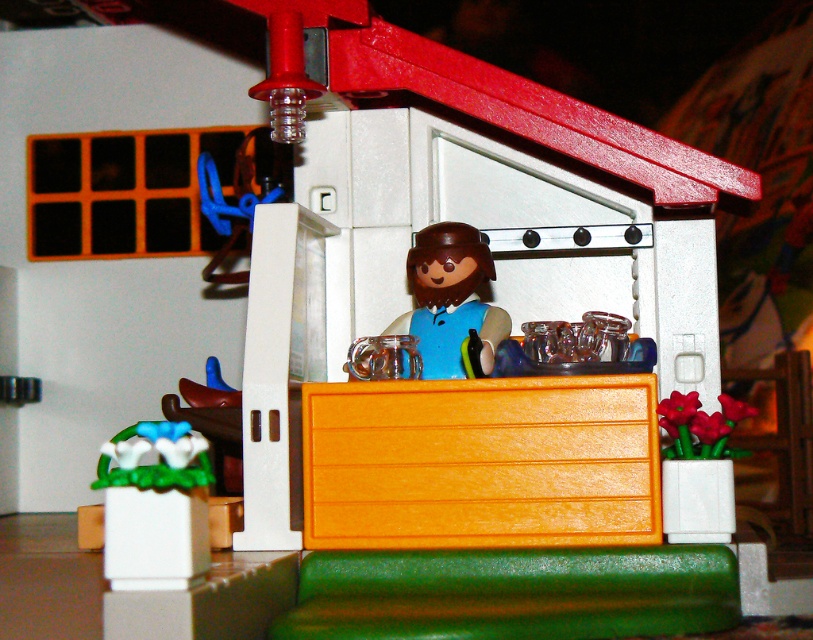
Question: Can you confirm if orange matte drawer at center is positioned to the left of white glossy flower pot at lower left?

Choices:
 (A) no
 (B) yes

Answer: (A)

Question: Can you confirm if orange matte drawer at center is positioned to the right of white glossy flower pot at lower left?

Choices:
 (A) no
 (B) yes

Answer: (B)

Question: Which point appears farthest from the camera in this image?

Choices:
 (A) (177, 538)
 (B) (457, 387)

Answer: (B)

Question: Which point appears closest to the camera in this image?

Choices:
 (A) (468, 486)
 (B) (188, 438)

Answer: (B)

Question: Is orange matte drawer at center closer to the viewer compared to white glossy flower pot at lower left?

Choices:
 (A) yes
 (B) no

Answer: (B)